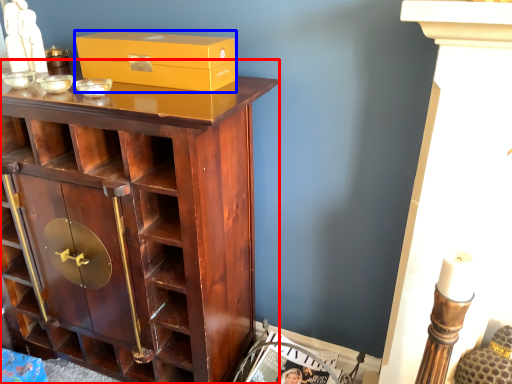
Question: Which point is closer to the camera, cupboard (highlighted by a red box) or box (highlighted by a blue box)?

Choices:
 (A) cupboard
 (B) box

Answer: (A)